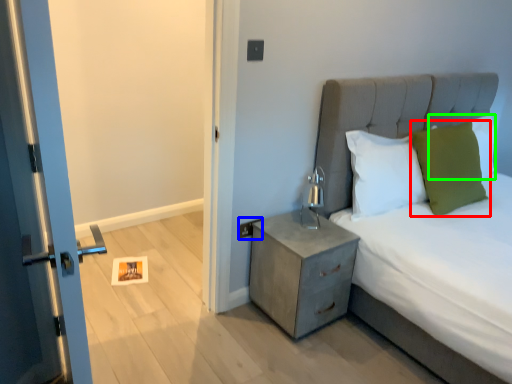
Question: Considering the real-world distances, which object is closest to pillow (highlighted by a red box)? electric outlet (highlighted by a blue box) or pillow (highlighted by a green box).

Choices:
 (A) electric outlet
 (B) pillow

Answer: (B)